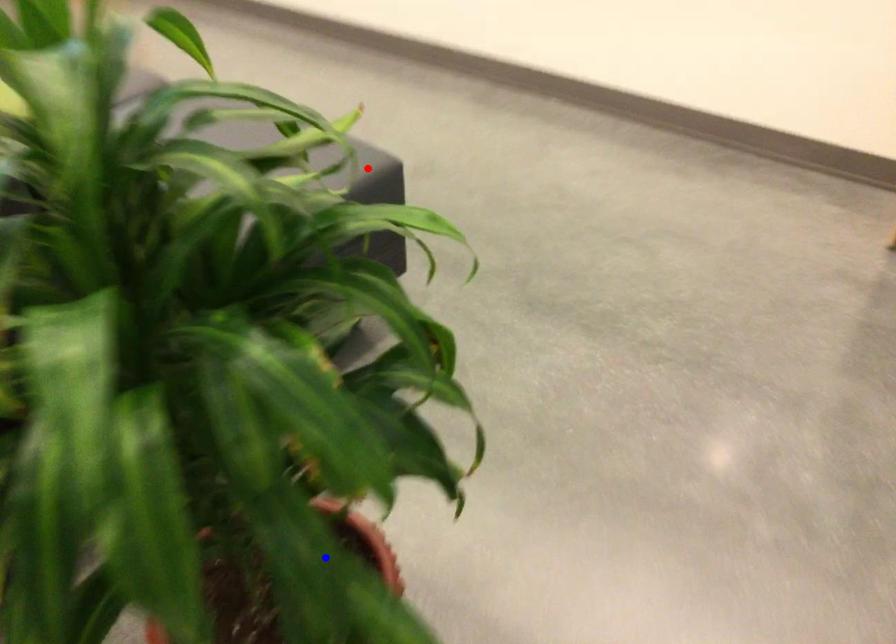
Question: Two points are marked on the image. Which point is closer to the camera?

Choices:
 (A) Blue point is closer.
 (B) Red point is closer.

Answer: (A)